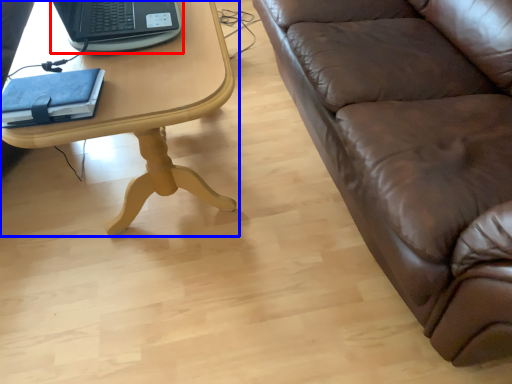
Question: Which point is further to the camera, laptop (highlighted by a red box) or table (highlighted by a blue box)?

Choices:
 (A) laptop
 (B) table

Answer: (A)